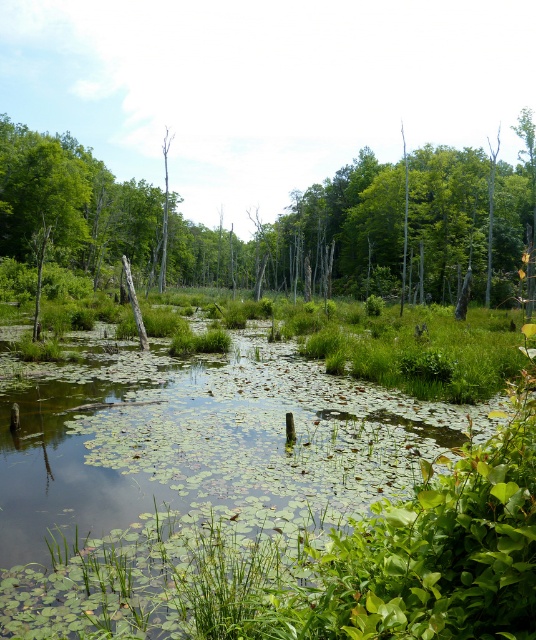
You are standing at the center of the wetland scene. Looking at the point marked at coordinates [259,500], what do you see there?

The point at coordinates [259,500] corresponds to green leafy vegetation at center.

You are a hiker who wants to cross the wetland area. You see the green leafy vegetation at center and the green matte tree at center. How far apart are these two landmarks?

The distance between the green leafy vegetation at center and the green matte tree at center is 43.03 meters.